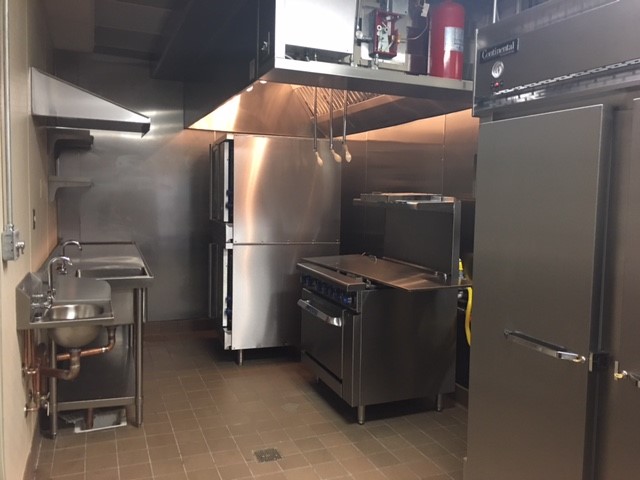
Where is `faucet`? faucet is located at coordinates (54, 264), (70, 243).